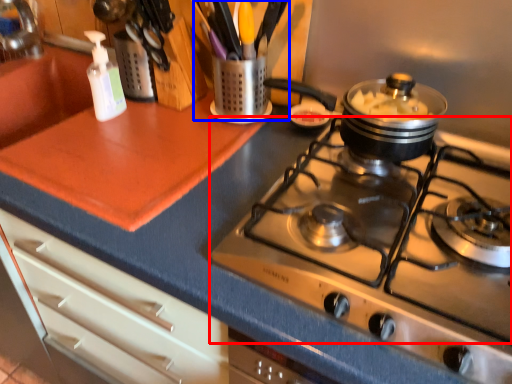
Question: Which point is closer to the camera, gas stove (highlighted by a red box) or appliance (highlighted by a blue box)?

Choices:
 (A) gas stove
 (B) appliance

Answer: (A)